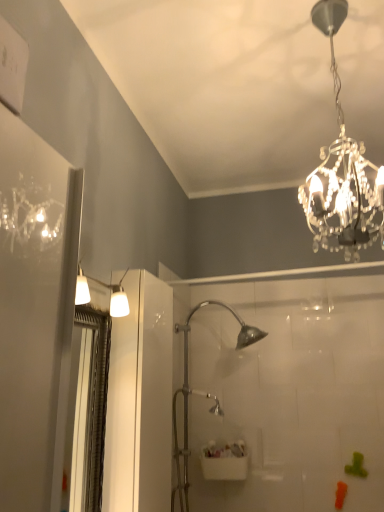
Question: From a real-world perspective, does white plastic sink at center stand above clear crystal chandelier at upper right?

Choices:
 (A) no
 (B) yes

Answer: (A)

Question: Does white plastic sink at center touch clear crystal chandelier at upper right?

Choices:
 (A) yes
 (B) no

Answer: (B)

Question: Considering the relative sizes of white plastic sink at center and clear crystal chandelier at upper right in the image provided, is white plastic sink at center thinner than clear crystal chandelier at upper right?

Choices:
 (A) yes
 (B) no

Answer: (A)

Question: Is white plastic sink at center outside of clear crystal chandelier at upper right?

Choices:
 (A) no
 (B) yes

Answer: (B)

Question: Is white plastic sink at center oriented away from clear crystal chandelier at upper right?

Choices:
 (A) yes
 (B) no

Answer: (B)

Question: Is white plastic sink at center wider than clear crystal chandelier at upper right?

Choices:
 (A) no
 (B) yes

Answer: (A)

Question: From the image's perspective, is clear plastic screen door at left below white plastic sink at center?

Choices:
 (A) no
 (B) yes

Answer: (A)

Question: Does clear plastic screen door at left come in front of white plastic sink at center?

Choices:
 (A) no
 (B) yes

Answer: (B)

Question: Can you confirm if clear plastic screen door at left is bigger than white plastic sink at center?

Choices:
 (A) no
 (B) yes

Answer: (B)

Question: Does clear plastic screen door at left have a greater width compared to white plastic sink at center?

Choices:
 (A) yes
 (B) no

Answer: (B)

Question: Considering the relative positions of clear plastic screen door at left and white plastic sink at center in the image provided, is clear plastic screen door at left behind white plastic sink at center?

Choices:
 (A) yes
 (B) no

Answer: (B)

Question: Is clear plastic screen door at left beside white plastic sink at center?

Choices:
 (A) yes
 (B) no

Answer: (B)

Question: Considering the relative positions of clear crystal chandelier at upper right and white plastic sink at center in the image provided, is clear crystal chandelier at upper right in front of white plastic sink at center?

Choices:
 (A) no
 (B) yes

Answer: (B)